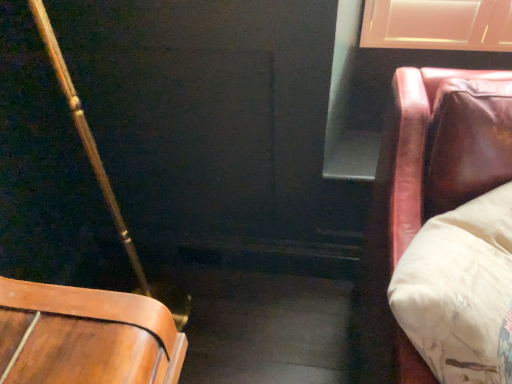
Describe the element at coordinates (426, 190) in the screenshot. I see `leather couch at right` at that location.

Where is `leather couch at right`? The image size is (512, 384). leather couch at right is located at coordinates (426, 190).

Where is `leather couch at right`? leather couch at right is located at coordinates (426, 190).